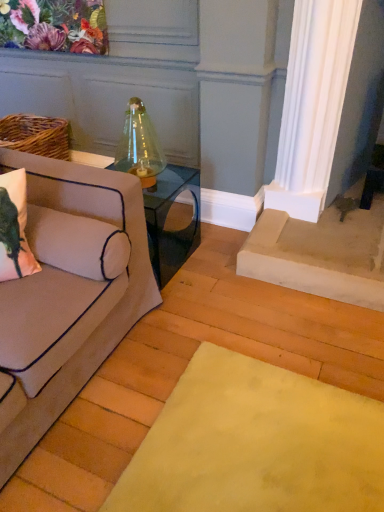
Question: Based on their sizes in the image, would you say beige fabric couch at left is bigger or smaller than clear glass table at center?

Choices:
 (A) small
 (B) big

Answer: (B)

Question: Considering the positions of point (125, 284) and point (148, 207), is point (125, 284) closer or farther from the camera than point (148, 207)?

Choices:
 (A) closer
 (B) farther

Answer: (A)

Question: Estimate the real-world distances between objects in this image. Which object is closer to the clear glass table at center?

Choices:
 (A) beige fabric couch at left
 (B) matte pink pillow at left

Answer: (A)

Question: Which of these objects is positioned closest to the beige fabric couch at left?

Choices:
 (A) matte pink pillow at left
 (B) clear glass table at center

Answer: (A)